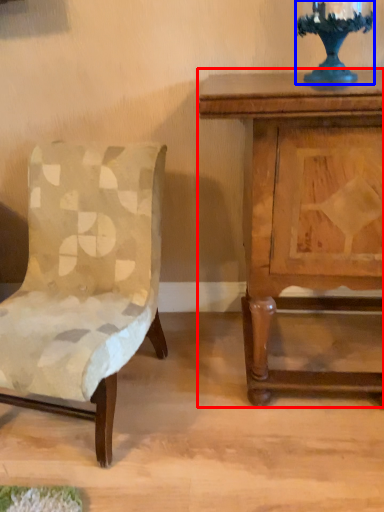
Question: Among these objects, which one is farthest to the camera, nightstand (highlighted by a red box) or candle holder (highlighted by a blue box)?

Choices:
 (A) nightstand
 (B) candle holder

Answer: (B)